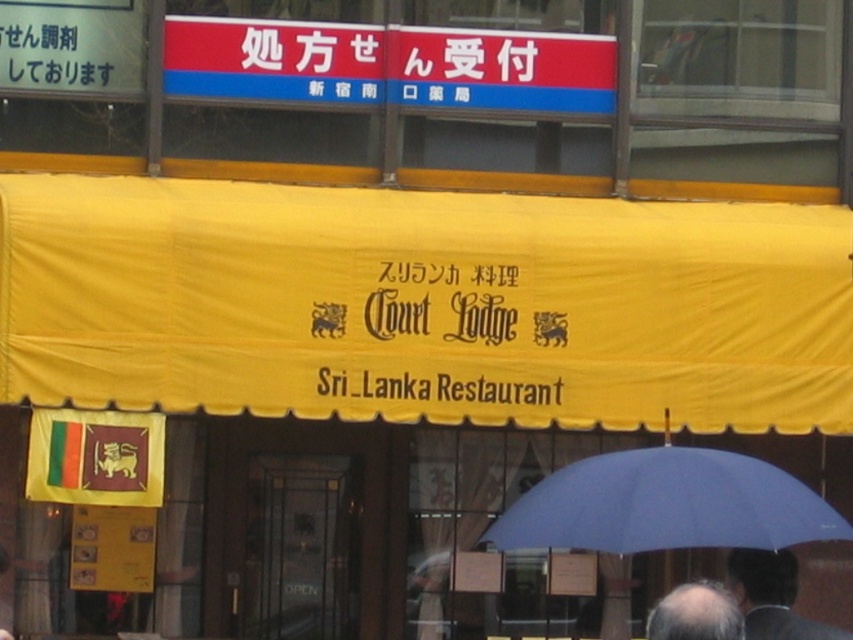
Question: Which point appears farthest from the camera in this image?

Choices:
 (A) (550, 221)
 (B) (749, 522)
 (C) (695, 624)

Answer: (A)

Question: Considering the relative positions of blue fabric umbrella at lower center and dark hair at lower right in the image provided, where is blue fabric umbrella at lower center located with respect to dark hair at lower right?

Choices:
 (A) above
 (B) below

Answer: (A)

Question: Which of these objects is positioned farthest from the yellow fabric canopy at center?

Choices:
 (A) blue fabric umbrella at lower center
 (B) dark hair at lower right

Answer: (B)

Question: In this image, where is blue fabric umbrella at lower center located relative to dark hair at lower right?

Choices:
 (A) below
 (B) above

Answer: (B)

Question: Is dark hair at lower right above bald head at lower center?

Choices:
 (A) yes
 (B) no

Answer: (B)

Question: Among these points, which one is farthest from the camera?

Choices:
 (A) [x=102, y=244]
 (B) [x=730, y=512]

Answer: (A)